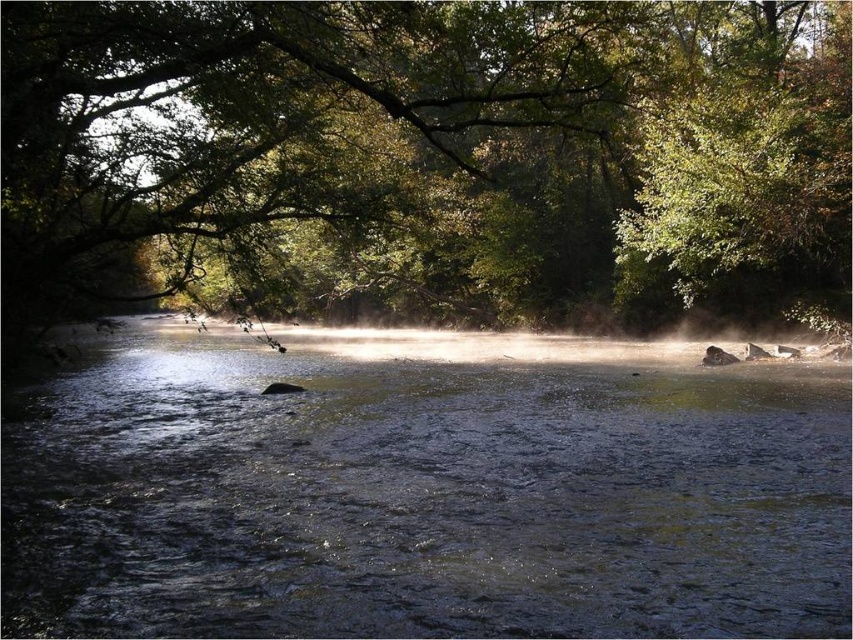
Can you confirm if green leafy tree at center is bigger than clear water at center?

Yes, green leafy tree at center is bigger than clear water at center.

Is point (282, 276) closer to camera compared to point (520, 547)?

No, it is behind (520, 547).

Identify the location of green leafy tree at center. This screenshot has height=640, width=853. (427, 157).